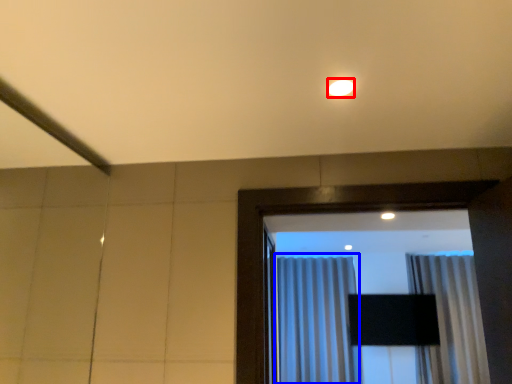
Question: Which of the following is the farthest to the observer, lighting (highlighted by a red box) or curtain (highlighted by a blue box)?

Choices:
 (A) lighting
 (B) curtain

Answer: (B)